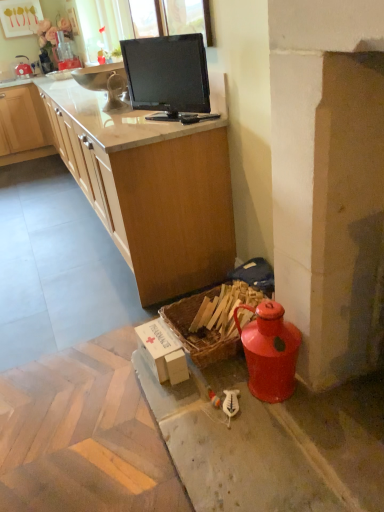
The image size is (384, 512). I want to click on vacant region in front of woven wood picnic basket at lower right, so click(x=237, y=423).